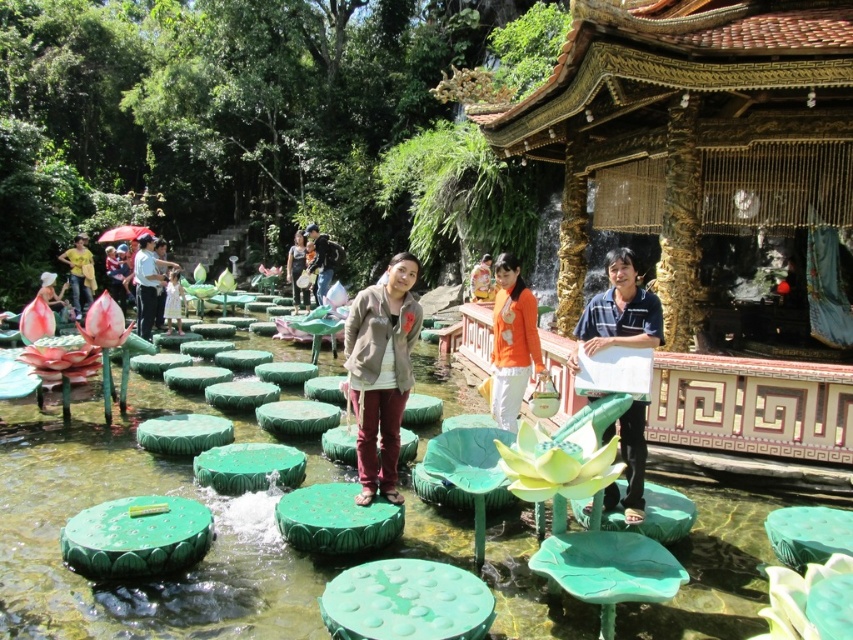
Can you confirm if matte gray jacket at center is shorter than matte gray shirt at center?

No, matte gray jacket at center is not shorter than matte gray shirt at center.

Is matte gray jacket at center behind matte gray shirt at center?

No, matte gray jacket at center is in front of matte gray shirt at center.

Is point (386, 337) farther from camera compared to point (302, 257)?

No.

The width and height of the screenshot is (853, 640). Find the location of `matte gray jacket at center`. matte gray jacket at center is located at coordinates (381, 372).

Is point (624, 292) closer to viewer compared to point (532, 356)?

Yes, point (624, 292) is in front of point (532, 356).

Which is more to the right, matte black shirt at center or orange fabric shirt at center?

Positioned to the right is matte black shirt at center.

Is point (608, 337) closer to camera compared to point (509, 358)?

Yes, it is.

This screenshot has height=640, width=853. Identify the location of matte black shirt at center. pos(619,308).

Does matte black shirt at center have a smaller size compared to matte gray shirt at center?

Incorrect, matte black shirt at center is not smaller in size than matte gray shirt at center.

Between matte black shirt at center and matte gray shirt at center, which one has less height?

matte gray shirt at center is shorter.

Between point (628, 452) and point (299, 232), which one is positioned behind?

Positioned behind is point (299, 232).

The width and height of the screenshot is (853, 640). Find the location of `matte black shirt at center`. matte black shirt at center is located at coordinates (619, 308).